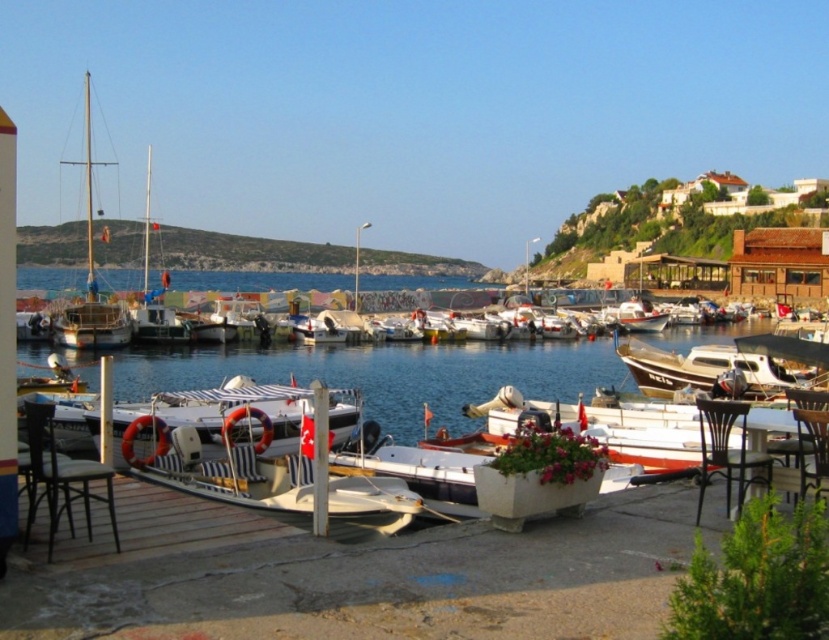
You are planning to place a small potted plant next to the black metal chair at lower right. Based on the scene, will the clear blue water at center be visible from the potted plant?

The clear blue water at center is larger in size than the black metal chair at lower right, so yes, the water will still be visible from the potted plant placed next to the chair.

You are standing on the dock and want to board the white glossy boat at center. Which side of the wooden chair at lower right should you walk around to reach it?

The white glossy boat at center is positioned on the right side of wooden chair at lower right, so you should walk around the right side of the wooden chair at lower right to reach it.

You are standing at the center of the dock and want to locate the white glossy boat at center. According to the coordinates provided, in which direction should you look to find it?

The white glossy boat at center is located at coordinates point (726, 364), so you should look towards the lower right direction from the center of the dock to find it.